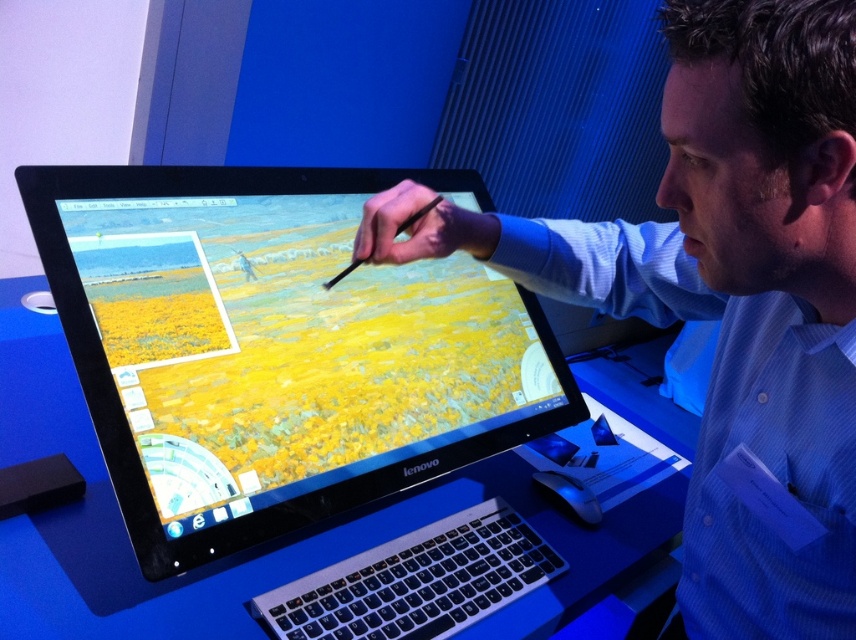
Can you confirm if black glossy monitor at center is positioned to the right of blue striped shirt at center?

Incorrect, black glossy monitor at center is not on the right side of blue striped shirt at center.

How far apart are black glossy monitor at center and blue striped shirt at center?

black glossy monitor at center is 12.03 inches away from blue striped shirt at center.

Is point (63, 179) closer to camera compared to point (779, 429)?

No, it is not.

This screenshot has height=640, width=856. What are the coordinates of `black glossy monitor at center` in the screenshot? It's located at (276, 348).